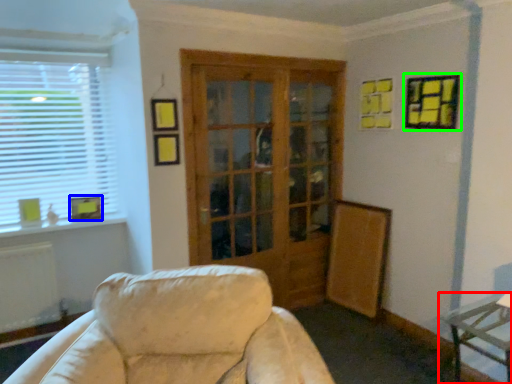
Question: Estimate the real-world distances between objects in this image. Which object is farther from table (highlighted by a red box), picture frame (highlighted by a blue box) or picture frame (highlighted by a green box)?

Choices:
 (A) picture frame
 (B) picture frame

Answer: (A)